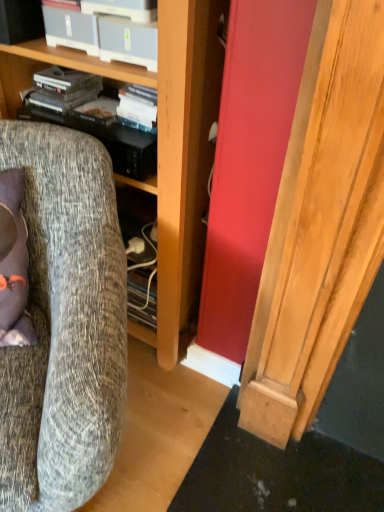
Question: From a real-world perspective, is matte black shelf at upper left above or below textured gray fabric chair at left?

Choices:
 (A) above
 (B) below

Answer: (A)

Question: Based on their positions, is matte black shelf at upper left located to the left or right of textured gray fabric chair at left?

Choices:
 (A) left
 (B) right

Answer: (B)

Question: Considering the real-world distances, which object is closest to the textured gray fabric chair at left?

Choices:
 (A) wooden cabinet at center
 (B) matte black shelf at upper left

Answer: (A)

Question: Which is nearer to the textured gray fabric chair at left?

Choices:
 (A) wooden cabinet at center
 (B) matte black shelf at upper left

Answer: (A)